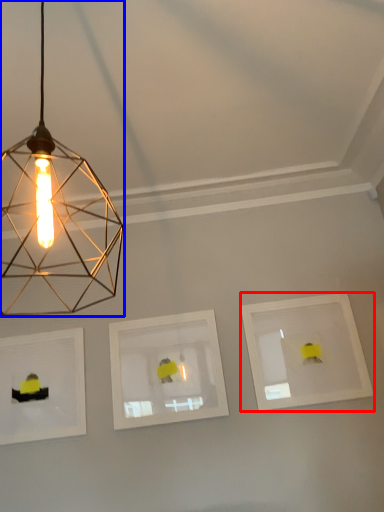
Question: Which object appears farthest to the camera in this image, picture frame (highlighted by a red box) or lamp (highlighted by a blue box)?

Choices:
 (A) picture frame
 (B) lamp

Answer: (A)